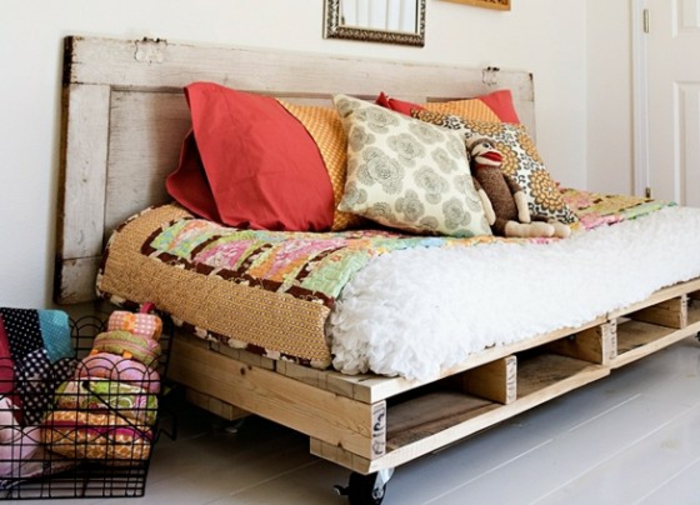
You are a GUI agent. You are given a task and a screenshot of the screen. Output one action in this format:
    pyautogui.click(x=<x>, y=<y>)
    Task: Click on the black basket
    The width and height of the screenshot is (700, 505).
    Given the screenshot: What is the action you would take?
    pyautogui.click(x=52, y=499)